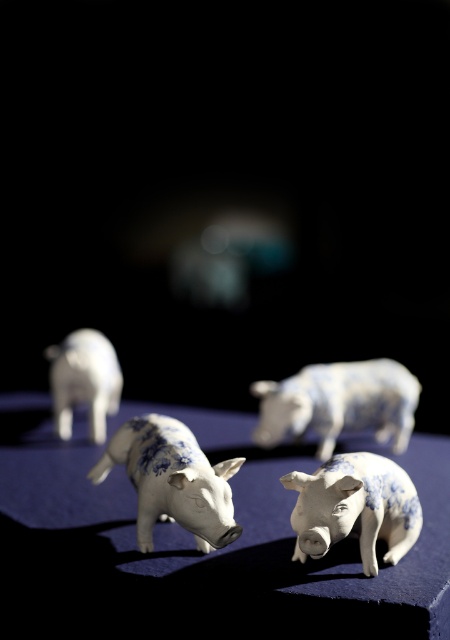
Question: Is porcelain pig at center behind white glossy pig at left?

Choices:
 (A) yes
 (B) no

Answer: (B)

Question: Is blue and white ceramic pig at center wider than blue and white porcelain pig at center?

Choices:
 (A) no
 (B) yes

Answer: (A)

Question: Which point is farther from the camera taking this photo?

Choices:
 (A) [117, 433]
 (B) [95, 397]
 (C) [352, 372]

Answer: (B)

Question: Which of the following is the farthest from the observer?

Choices:
 (A) (273, 429)
 (B) (310, 497)
 (C) (140, 497)

Answer: (A)

Question: Is porcelain pig at center to the left of white glossy pig at left from the viewer's perspective?

Choices:
 (A) yes
 (B) no

Answer: (B)

Question: Considering the real-world distances, which object is farthest from the blue and white porcelain pig at center?

Choices:
 (A) porcelain pig at center
 (B) blue and white ceramic pig at center

Answer: (A)